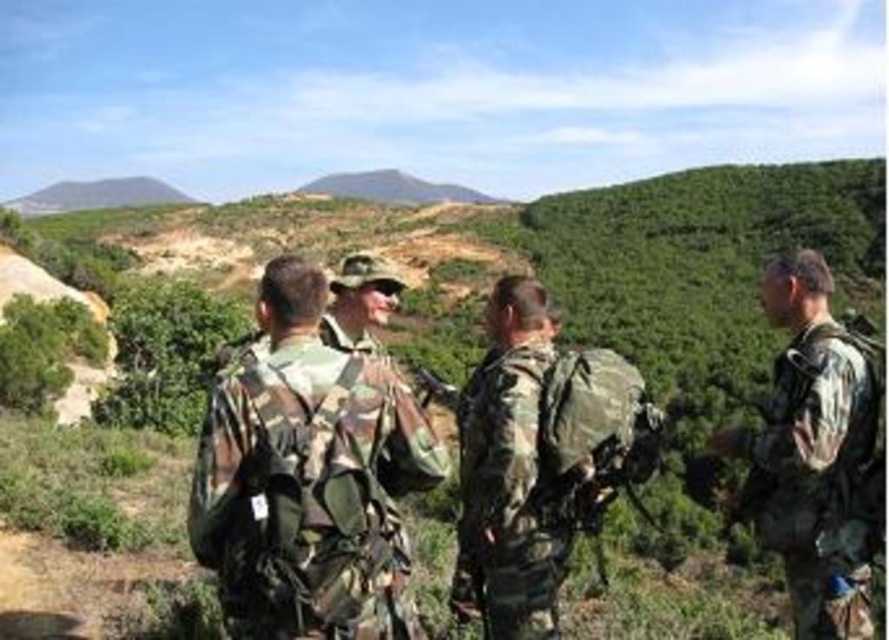
Does camouflage fabric uniform at center appear on the right side of camouflage fabric backpack at right?

No, camouflage fabric uniform at center is not to the right of camouflage fabric backpack at right.

Does camouflage fabric uniform at center have a greater height compared to camouflage fabric backpack at right?

No, camouflage fabric uniform at center is not taller than camouflage fabric backpack at right.

Between point (300, 384) and point (775, 282), which one is positioned behind?

Point (775, 282)

Identify the location of camouflage fabric uniform at center. (310, 493).

Which is above, camouflage fabric backpack at right or camouflage fabric backpack at center?

Positioned higher is camouflage fabric backpack at right.

From the picture: Who is more forward, (847,621) or (485,522)?

Point (847,621) is in front.

Who is more forward, (806, 516) or (466, 561)?

Positioned in front is point (806, 516).

I want to click on camouflage fabric backpack at right, so click(x=817, y=454).

Between point (372, 428) and point (490, 440), which one is positioned in front?

Point (372, 428) is more forward.

Who is positioned more to the left, camouflage fabric uniform at center or camouflage fabric backpack at center?

camouflage fabric uniform at center

Which is in front, point (347, 561) or point (498, 600)?

Point (347, 561) is more forward.

At what (x,y) coordinates should I click in order to perform the action: click on camouflage fabric uniform at center. Please return your answer as a coordinate pair (x, y). Image resolution: width=889 pixels, height=640 pixels. Looking at the image, I should click on (310, 493).